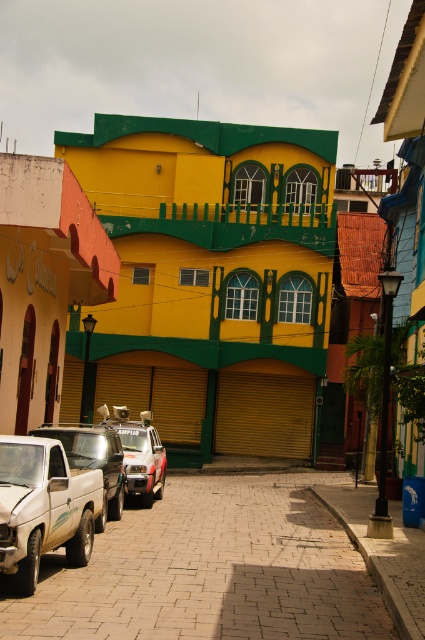
The width and height of the screenshot is (425, 640). What do you see at coordinates (44, 508) in the screenshot?
I see `white matte truck at lower left` at bounding box center [44, 508].

Is white matte truck at lower left in front of white matte truck at left?

That is True.

Does point (30, 468) come in front of point (108, 484)?

Yes.

The width and height of the screenshot is (425, 640). What are the coordinates of `white matte truck at lower left` in the screenshot? It's located at (44, 508).

Who is positioned more to the right, white matte truck at left or white matte car at center?

Positioned to the right is white matte truck at left.

Between white matte truck at left and white matte car at center, which one has less height?

white matte truck at left is shorter.

Between point (48, 433) and point (147, 493), which one is positioned in front?

Point (48, 433)

Find the location of a particular element. white matte truck at left is located at coordinates (93, 460).

Does white matte truck at lower left have a greater height compared to white matte car at center?

No, white matte truck at lower left is not taller than white matte car at center.

Is white matte truck at lower left in front of white matte car at center?

Yes, white matte truck at lower left is in front of white matte car at center.

Locate an element on the screen. white matte truck at lower left is located at coordinates (44, 508).